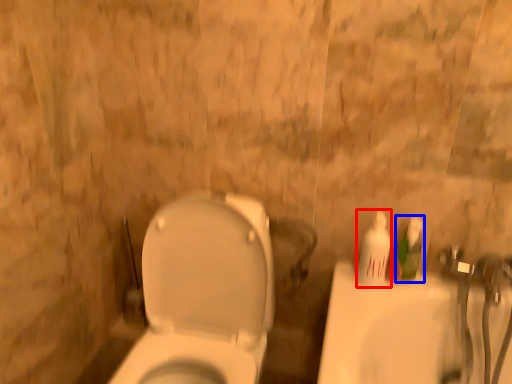
Question: Which of the following is the closest to the observer, mouthwash (highlighted by a red box) or mouthwash (highlighted by a blue box)?

Choices:
 (A) mouthwash
 (B) mouthwash

Answer: (A)